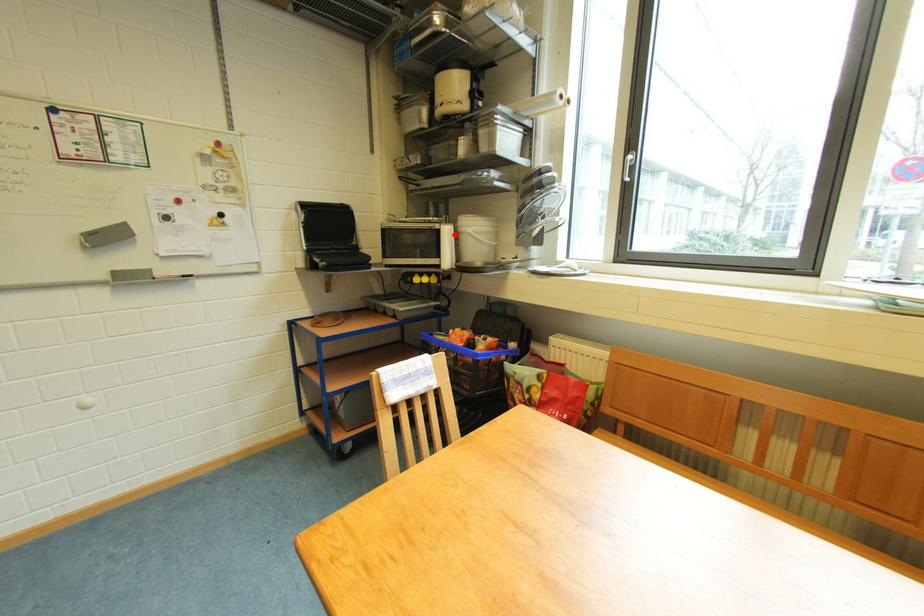
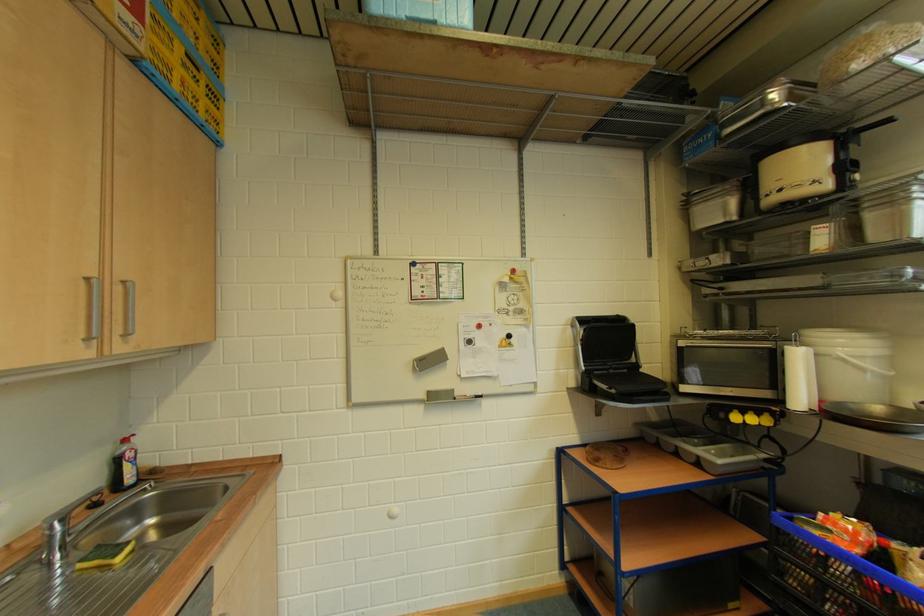
Locate, in the second image, the point that corresponds to the highlighted location in the first image.

(805, 359)